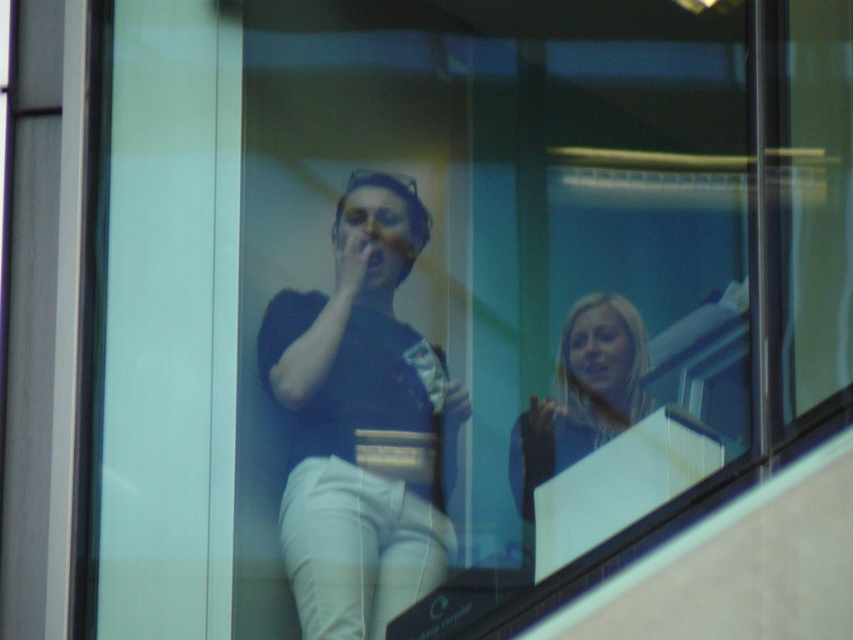
Question: Does matte black shirt at center appear on the right side of blonde hair at center?

Choices:
 (A) no
 (B) yes

Answer: (A)

Question: Can you confirm if matte black shirt at center is positioned above blonde hair at center?

Choices:
 (A) yes
 (B) no

Answer: (A)

Question: Which point is closer to the camera?

Choices:
 (A) matte black shirt at center
 (B) blonde hair at center

Answer: (A)

Question: Does matte black shirt at center have a greater width compared to blonde hair at center?

Choices:
 (A) yes
 (B) no

Answer: (A)

Question: Among these objects, which one is nearest to the camera?

Choices:
 (A) blonde hair at center
 (B) matte black shirt at center

Answer: (B)

Question: Which point appears farthest from the camera in this image?

Choices:
 (A) (445, 384)
 (B) (630, 355)

Answer: (B)